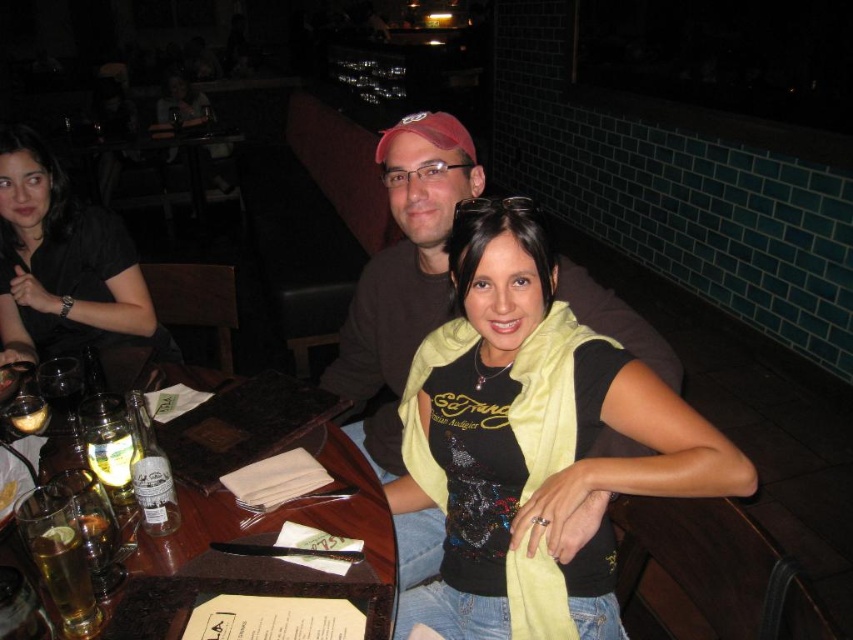
You are sitting at the wooden table at lower left and want to hand a napkin to the person wearing the matte black shirt at upper left. Can you reach them without leaving your seat?

The wooden table at lower left is below matte black shirt at upper left, so you can reach them without leaving your seat since the shirt is above the table where you are sitting.

You are trying to place a rectangular plate that is 10 inches wide on the wooden table at lower left. Can the satin yellow scarf at center be placed alongside the plate without overlapping?

The satin yellow scarf at center has a lesser width compared to the wooden table at lower left, so it can be placed alongside the 10 inch plate without overlapping as long as the combined width of both items does not exceed the table width.